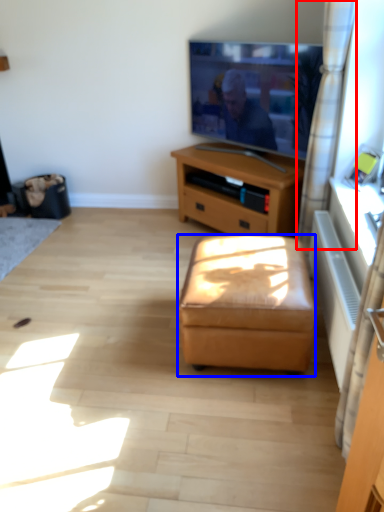
Question: Which point is closer to the camera, curtain (highlighted by a red box) or stool (highlighted by a blue box)?

Choices:
 (A) curtain
 (B) stool

Answer: (B)